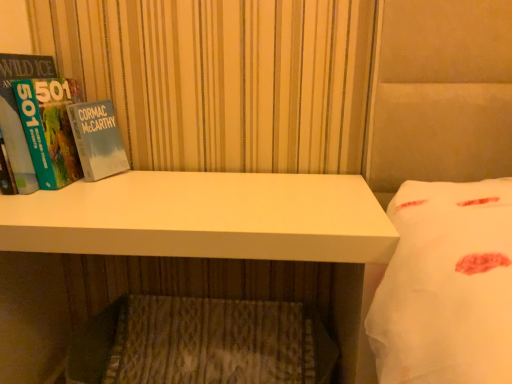
Question: Is hardcover book at left oriented away from white matte desk at center?

Choices:
 (A) yes
 (B) no

Answer: (B)

Question: Considering the relative positions of hardcover book at left and white matte desk at center in the image provided, is hardcover book at left to the left of white matte desk at center from the viewer's perspective?

Choices:
 (A) no
 (B) yes

Answer: (B)

Question: From a real-world perspective, does hardcover book at left stand above white matte desk at center?

Choices:
 (A) yes
 (B) no

Answer: (A)

Question: From the image's perspective, is hardcover book at left located above white matte desk at center?

Choices:
 (A) no
 (B) yes

Answer: (B)

Question: Can you confirm if hardcover book at left is bigger than white matte desk at center?

Choices:
 (A) yes
 (B) no

Answer: (B)

Question: Is white matte desk at center inside the boundaries of wooden textured mattress at lower center, or outside?

Choices:
 (A) inside
 (B) outside

Answer: (A)

Question: Considering the positions of white matte desk at center and wooden textured mattress at lower center in the image, is white matte desk at center taller or shorter than wooden textured mattress at lower center?

Choices:
 (A) short
 (B) tall

Answer: (B)

Question: From the image's perspective, relative to wooden textured mattress at lower center, is white matte desk at center above or below?

Choices:
 (A) above
 (B) below

Answer: (A)

Question: From a real-world perspective, relative to wooden textured mattress at lower center, is white matte desk at center vertically above or below?

Choices:
 (A) above
 (B) below

Answer: (A)

Question: Would you say wooden textured mattress at lower center is inside or outside white matte desk at center?

Choices:
 (A) outside
 (B) inside

Answer: (B)

Question: Is wooden textured mattress at lower center taller or shorter than white matte desk at center?

Choices:
 (A) tall
 (B) short

Answer: (B)

Question: Is point (234, 380) positioned closer to the camera than point (105, 206)?

Choices:
 (A) farther
 (B) closer

Answer: (A)

Question: Is wooden textured mattress at lower center wider or thinner than white matte desk at center?

Choices:
 (A) wide
 (B) thin

Answer: (B)

Question: Which is correct: hardcover book at left is inside wooden textured mattress at lower center, or outside of it?

Choices:
 (A) outside
 (B) inside

Answer: (A)

Question: In terms of size, does hardcover book at left appear bigger or smaller than wooden textured mattress at lower center?

Choices:
 (A) small
 (B) big

Answer: (A)